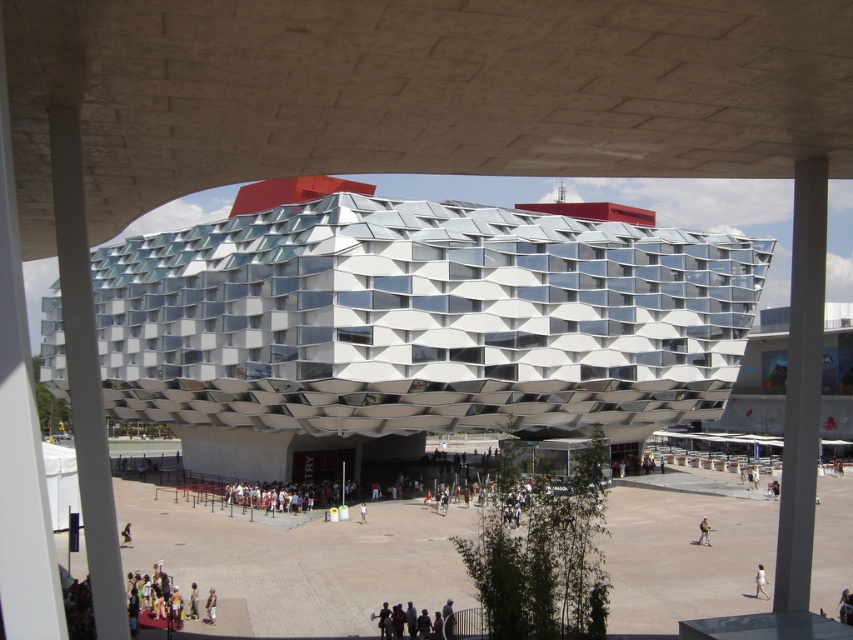
Is point (209, 605) positioned after point (700, 532)?

No, it is in front of (700, 532).

Find the location of a particular element. The height and width of the screenshot is (640, 853). tan fabric shorts at lower center is located at coordinates (210, 605).

Between white matte person at lower right and light brown fabric jacket at lower center, which one appears on the left side from the viewer's perspective?

From the viewer's perspective, white matte person at lower right appears more on the left side.

How distant is white matte person at lower right from light brown fabric jacket at lower center?

The distance of white matte person at lower right from light brown fabric jacket at lower center is 31.08 feet.

Is point (759, 586) more distant than point (701, 524)?

No, it is in front of (701, 524).

The height and width of the screenshot is (640, 853). What are the coordinates of `white matte person at lower right` in the screenshot? It's located at (759, 580).

Which is behind, point (192, 365) or point (757, 564)?

The point (192, 365) is behind.

Does white textured building at center have a greater height compared to white matte person at lower right?

Correct, white textured building at center is much taller as white matte person at lower right.

Locate an element on the screen. The height and width of the screenshot is (640, 853). white textured building at center is located at coordinates (415, 323).